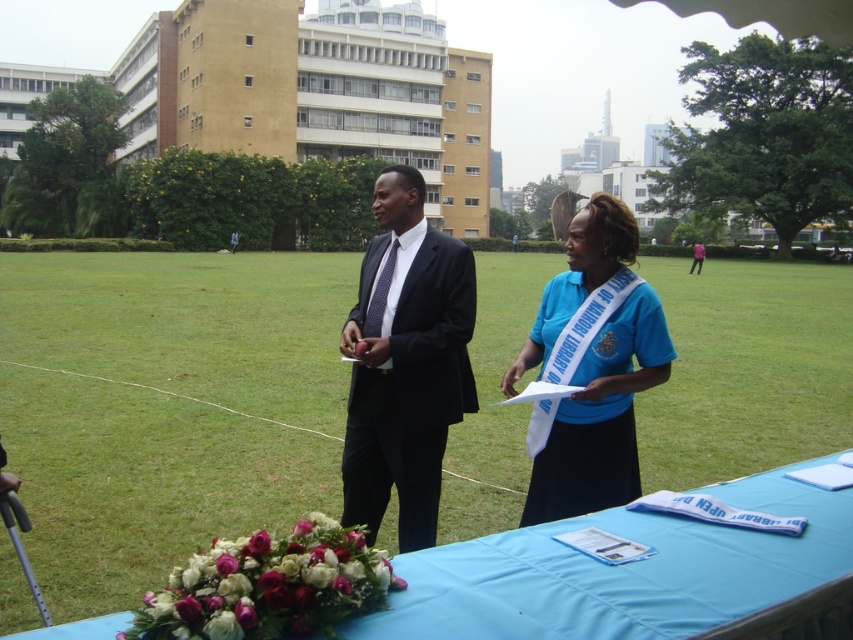
You are a delivery person standing at the entrance of the park, and you need to place a package between the blue fabric table at center and the matte black suit at center. Can you fit the package in the space between them if the package is 1.5 meters long?

The distance between the blue fabric table at center and the matte black suit at center is 1.47 meters, which is shorter than the 1.5 meters package. Therefore, the package cannot fit in the space between them.

You are standing at the entrance of the building and want to approach the matte black suit at center. Which direction should you walk to reach it?

The matte black suit at center is located at point coordinates, so you should walk towards the center of the scene to reach it.